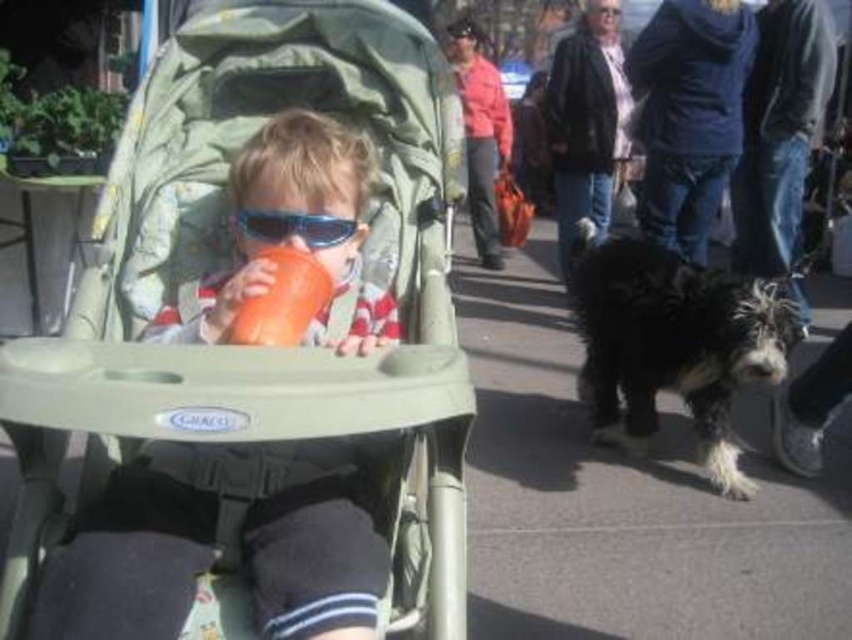
You are a delivery person carrying a large package that is the same size as the matte green stroller at center. You need to place it on the same spot where the orange matte cup at center is currently located. Will the package fit in that space?

The matte green stroller at center is bigger than the orange matte cup at center. Since the package is the same size as the stroller, it will not fit in the space where the cup is located because the cup is smaller and occupies less space.

You are standing at the edge of the street and want to take a photo of the matte green stroller at center. If your camera can focus on objects within 35 inches, will it be able to capture the stroller clearly?

The matte green stroller at center is 34.89 inches away from the camera, which is within the 35 inches focus range. Therefore, the camera can capture the stroller clearly.

You are a delivery robot navigating a busy street. You need to deliver a package to the point at coordinates point (292,602). However, there is an obstacle at point (242,330). Will you be able to reach the delivery point without going around the obstacle?

Point (292,602) is in front of point (242,330), so the delivery robot can reach the delivery point without needing to go around the obstacle as it is positioned ahead of the obstacle.